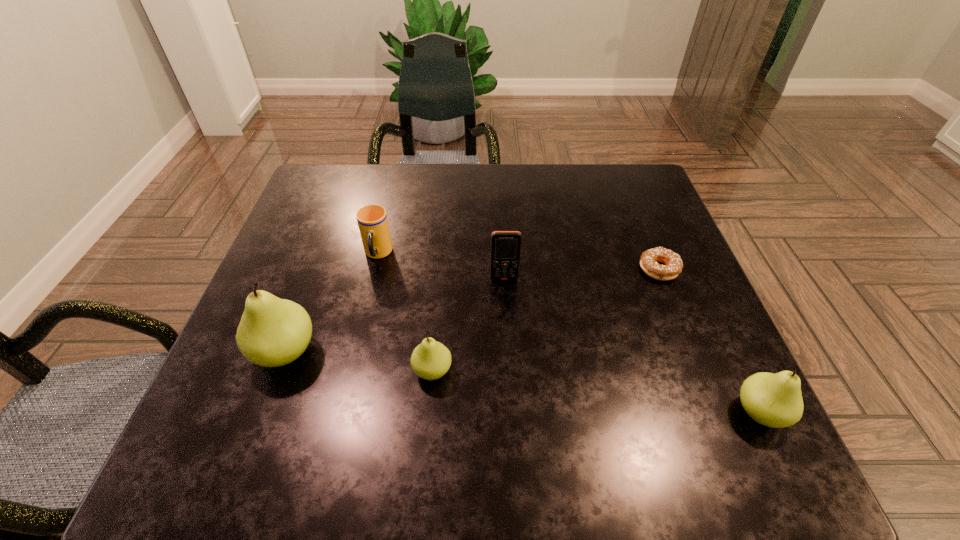
The width and height of the screenshot is (960, 540). Find the location of `free point between the shortest pear and the cup`. free point between the shortest pear and the cup is located at coordinates (405, 312).

I want to click on vacant region between the shortest pear and the leftmost pear, so click(x=359, y=361).

The image size is (960, 540). In order to click on free space between the third object from left to right and the doughnut in this screenshot , I will do coord(545,320).

Locate an element on the screen. The image size is (960, 540). vacant space that's between the third object from right to left and the leftmost object is located at coordinates (395, 315).

Image resolution: width=960 pixels, height=540 pixels. Find the location of `free spot between the shortest object and the rightmost pear`. free spot between the shortest object and the rightmost pear is located at coordinates (709, 341).

Identify the location of object that stands as the second closest to the doughnut. (505, 245).

Find the location of a particular element. The image size is (960, 540). object that is the closest one to the fifth object from right to left is located at coordinates (273, 332).

You are a GUI agent. You are given a task and a screenshot of the screen. Output one action in this format:
    pyautogui.click(x=<x>, y=<y>)
    Task: Click on the pear that is the second closest to the doughnut
    The image size is (960, 540).
    Given the screenshot: What is the action you would take?
    pyautogui.click(x=430, y=360)

Locate which pear is the closest to the leftmost object. Please provide its 2D coordinates. Your answer should be formatted as a tuple, i.e. [(x, y)], where the tuple contains the x and y coordinates of a point satisfying the conditions above.

[(430, 360)]

Locate an element on the screen. This screenshot has height=540, width=960. free space that satisfies the following two spatial constraints: 1. on the side of the second object from left to right with the handle; 2. on the right side of the shortest pear is located at coordinates (350, 370).